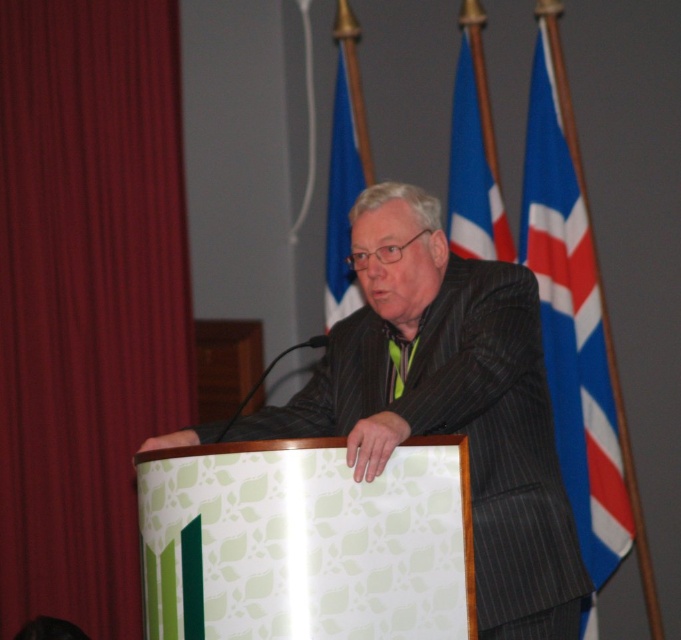
Who is shorter, blue fabric flag at center or green satin tie at center?

green satin tie at center is shorter.

Does blue fabric flag at center have a larger size compared to green satin tie at center?

Correct, blue fabric flag at center is larger in size than green satin tie at center.

Which is in front, point (334, 291) or point (398, 392)?

Point (398, 392) is more forward.

This screenshot has width=681, height=640. I want to click on blue fabric flag at center, so click(x=345, y=179).

Can you confirm if blue fabric flag at right is thinner than blue fabric flag at upper center?

→ No.

What do you see at coordinates (571, 324) in the screenshot? The width and height of the screenshot is (681, 640). I see `blue fabric flag at right` at bounding box center [571, 324].

Find the location of a particular element. The image size is (681, 640). blue fabric flag at right is located at coordinates (571, 324).

Can you confirm if red velvet curtain at upper left is positioned below green satin tie at center?

Incorrect, red velvet curtain at upper left is not positioned below green satin tie at center.

Which is in front, point (76, 92) or point (392, 362)?

Point (392, 362) is more forward.

Does point (37, 6) come farther from viewer compared to point (394, 385)?

Yes, point (37, 6) is behind point (394, 385).

At what (x,y) coordinates should I click in order to perform the action: click on red velvet curtain at upper left. Please return your answer as a coordinate pair (x, y). This screenshot has height=640, width=681. Looking at the image, I should click on (86, 298).